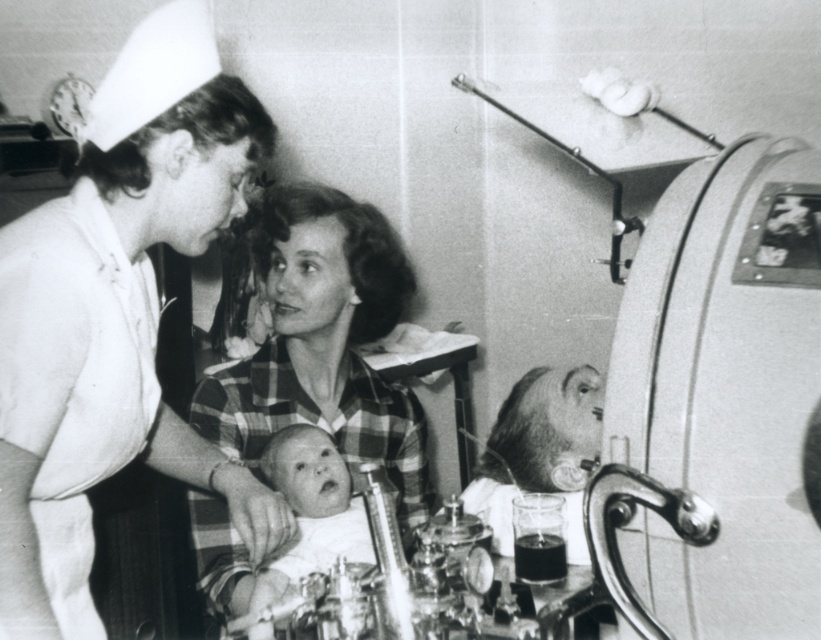
From the picture: You are a photographer standing in front of a 40 cm wide camera. You want to take a photo of the white uniform at center and the smooth white baby at center. Can your camera fit both subjects in the frame?

The white uniform at center and smooth white baby at center are 32.66 centimeters apart. Since the camera is 40 cm wide, it can fit both subjects as the distance between them is less than the camera width.

You are a photographer trying to capture a closeup of the smooth white baby at center without including the plaid fabric shirt at center in the frame. Given their relative sizes, is this possible?

The plaid fabric shirt at center is wider than the smooth white baby at center. Since the shirt is wider, it would likely block part of the baby in the frame, making it difficult to capture the baby without including the shirt.

You are a photographer adjusting your camera to focus on two specific points in the image. The first point is point (159, 468) and the second is point (271, 444). Which point should you focus on first if you want to capture the closest one to the viewer?

Point (159, 468) is closer to the viewer than point (271, 444), so you should focus on point (159, 468) first.